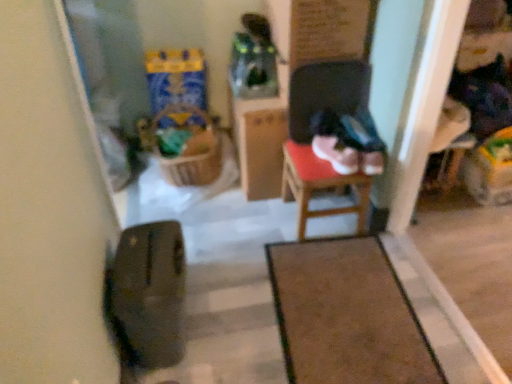
Find the location of a particular element. This screenshot has height=384, width=512. vacant space in brown carpet at center (from a real-world perspective) is located at coordinates (342, 310).